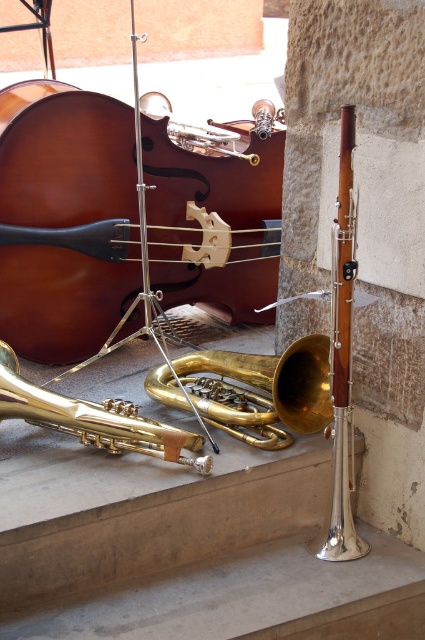
Question: Does matte brown cello at center appear under gold brass trumpet at center?

Choices:
 (A) yes
 (B) no

Answer: (B)

Question: Observing the image, what is the correct spatial positioning of matte brown cello at center in reference to gold shiny trumpet at center?

Choices:
 (A) left
 (B) right

Answer: (A)

Question: Among these objects, which one is farthest from the camera?

Choices:
 (A) matte brown cello at center
 (B) gold shiny trumpet at center

Answer: (A)

Question: Observing the image, what is the correct spatial positioning of matte brown cello at center in reference to gold shiny trumpet at lower left?

Choices:
 (A) below
 (B) above

Answer: (B)

Question: Which object is closer to the camera taking this photo?

Choices:
 (A) gold shiny trumpet at lower left
 (B) gold shiny trumpet at center
 (C) matte brown cello at center
 (D) gold brass trumpet at center

Answer: (D)

Question: Which object is closer to the camera taking this photo?

Choices:
 (A) matte brown cello at center
 (B) gold shiny trumpet at lower left

Answer: (B)